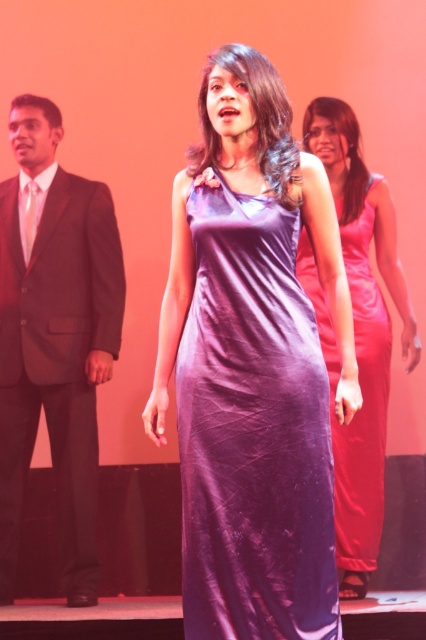
You are a photographer at the event and need to capture a shot that includes both the shiny black suit at left and the purple satin dress at center. Based on their positions, which one should you focus on first to ensure both are in frame?

The shiny black suit at left is positioned on the left side of the purple satin dress at center, so focusing on the purple satin dress at center first will naturally include the shiny black suit at left in the frame since it is to the left of the dress.

You are a photographer adjusting your camera settings. You need to focus on two specific points in the image, point (296, 620) and point (359, 422). Which point should you focus on first to ensure proper depth of field?

Point (296, 620) is closer to the camera than point (359, 422), so you should focus on point (296, 620) first to ensure proper depth of field.